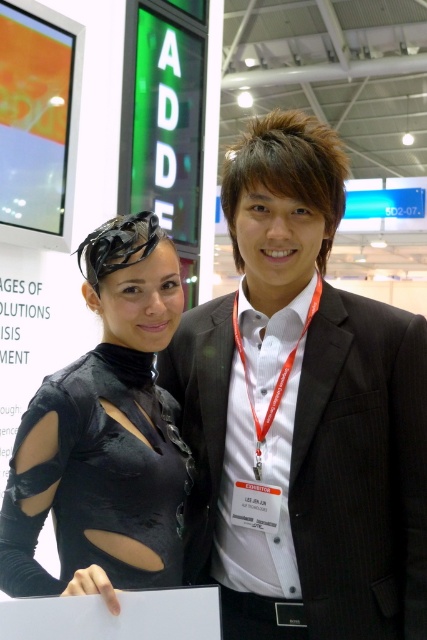
You are a photographer at the event and need to ensure both the black pinstripe suit at center and the matte black dress at center are visible in the photo. Which one should you position closer to the light source to avoid shadows?

The black pinstripe suit at center is positioned on the right side of matte black dress at center. Since the black pinstripe suit at center is on the right, you should position the matte black dress at center closer to the light source to ensure both are well lit and avoid shadows.

You are a photographer at the event and need to ensure both the black pinstripe suit at center and the matte black dress at center are fully visible in the photo. Which one should you adjust to be closer to the camera to avoid being blocked by the other?

The matte black dress at center should be moved closer to the camera because the black pinstripe suit at center is taller and could block it if they remain in their current positions.

Looking at this image, you are at the trade show booth and want to take a photo of the two points mentioned. Which point, point [344,298] or point [41,508], will appear closer to the camera in your photo?

Point [344,298] is further to the camera than point [41,508], so in the photo, point [344,298] will appear closer to the camera than point [41,508].